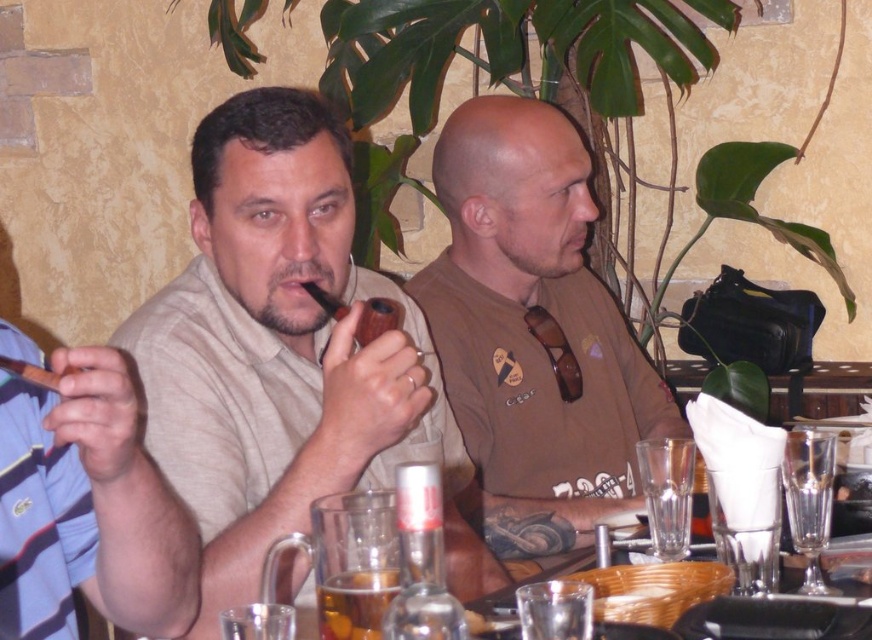
You are a photographer trying to capture a candid shot of the two men at the table. You notice two points of interest marked as point [230,467] and point [344,580]. Which point is closer to your camera lens?

Point [230,467] is further to the camera than point [344,580]. Therefore, point [230,467] is closer to the camera lens.

You are a waiter at this restaurant and need to place a 50 cm long tray between the matte brown pipe at center and the translucent glass mug at lower center. Can you fit the tray between them without moving either object?

The distance between the matte brown pipe at center and the translucent glass mug at lower center is 52.59 centimeters. Since the tray is 50 cm long, it can fit between them as the space available is slightly larger than the tray.

You are a server in a restaurant and need to place a new drink order on the table. The table has limited space between the brown wooden pipe at left and the translucent glass mug at lower center. Can you fit a coaster between them?

The brown wooden pipe at left might be wider than the translucent glass mug at lower center, so there may not be enough space to fit a coaster between them. Check the actual distance before placing the coaster.